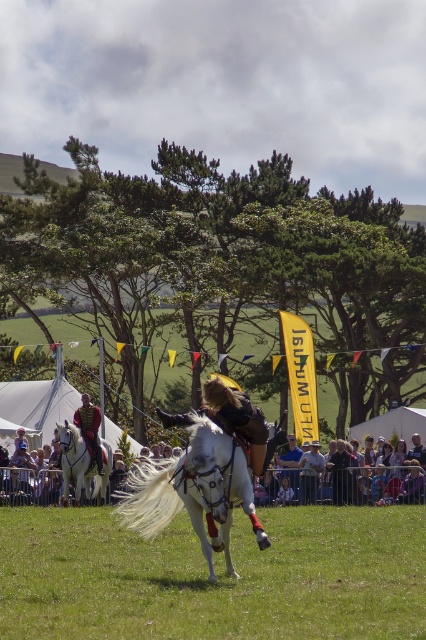
Question: Which point appears closest to the camera in this image?

Choices:
 (A) (204, 433)
 (B) (37, 490)
 (C) (414, 541)
 (D) (65, 490)

Answer: (A)

Question: Is green grass at center to the right of white glossy horse at left from the viewer's perspective?

Choices:
 (A) yes
 (B) no

Answer: (A)

Question: Which point is closer to the camera taking this photo?

Choices:
 (A) (232, 468)
 (B) (88, 456)

Answer: (A)

Question: From the image, what is the correct spatial relationship of green grass at center in relation to white glossy horse at center?

Choices:
 (A) below
 (B) above

Answer: (A)

Question: Which object is farther from the camera taking this photo?

Choices:
 (A) white glossy horse at left
 (B) green grass at center

Answer: (A)

Question: Is the position of white glossy horse at center more distant than that of white glossy horse at left?

Choices:
 (A) no
 (B) yes

Answer: (A)